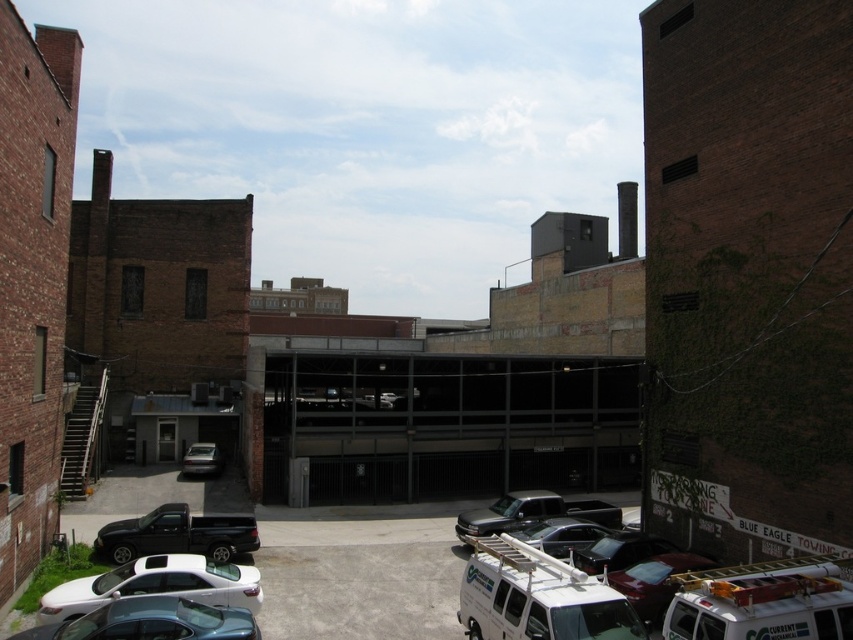
You are standing at the point with coordinates (x=537, y=596) in the urban scene. What object is located exactly at this point?

The white matte van at lower right is located exactly at point 0.931, 0.631.

You are a delivery person who needs to park your vehicle in this area. You have a large delivery truck that is 6 meters long. There is space between the white matte sedan at lower left and the teal glossy sedan at lower left. Do you think your truck can fit in that space?

The white matte sedan at lower left is larger in size than the teal glossy sedan at lower left, but the exact length of the space between them isn not provided. Therefore, it is uncertain if the truck can fit.

You are standing at the entrance of the alleyway and want to locate the white matte van at lower right. According to the coordinates provided, where exactly should you look to find it?

The white matte van at lower right is located at point (537, 596).